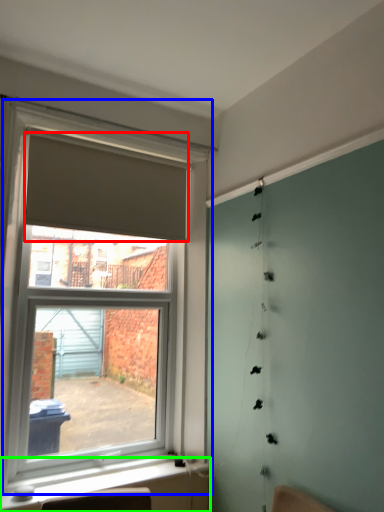
Question: Based on their relative distances, which object is farther from curtain (highlighted by a red box)? Choose from window (highlighted by a blue box) and window sill (highlighted by a green box).

Choices:
 (A) window
 (B) window sill

Answer: (B)